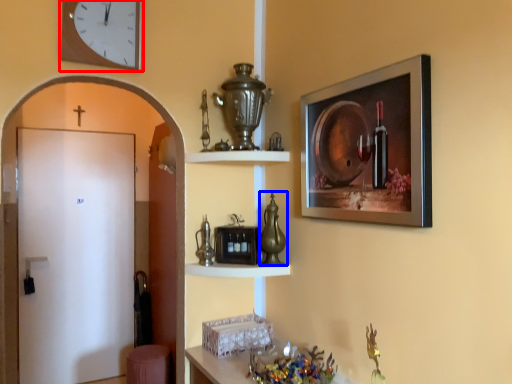
Question: Which object is closer to the camera taking this photo, clock (highlighted by a red box) or glass vase (highlighted by a blue box)?

Choices:
 (A) clock
 (B) glass vase

Answer: (A)